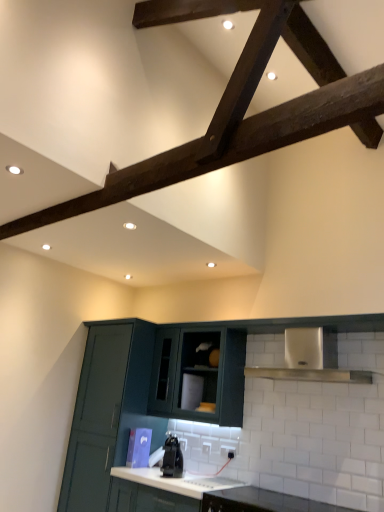
What do you see at coordinates (199, 375) in the screenshot?
I see `matte dark green cabinet at center, the 2th cabinetry viewed from the left` at bounding box center [199, 375].

Describe the element at coordinates (108, 410) in the screenshot. I see `matte dark green cabinet at lower left, which is the 3th cabinetry from right to left` at that location.

Identify the location of black glossy kettle at center. The height and width of the screenshot is (512, 384). (172, 458).

What do you see at coordinates (262, 502) in the screenshot? Image resolution: width=384 pixels, height=512 pixels. I see `white glossy countertop at lower center, the second countertop in the left-to-right sequence` at bounding box center [262, 502].

The height and width of the screenshot is (512, 384). I want to click on white glossy countertop at lower center, arranged as the 1th countertop when viewed from the right, so click(262, 502).

You are a GUI agent. You are given a task and a screenshot of the screen. Output one action in this format:
    pyautogui.click(x=<x>, y=<y>)
    Task: Click on the matte dark green cabinet at center, the 2th cabinetry viewed from the left
    Image resolution: width=384 pixels, height=512 pixels.
    Given the screenshot: What is the action you would take?
    pyautogui.click(x=199, y=375)

Can you confirm if matte dark green cabinet at lower left, which is the 3th cabinetry from right to left, is taller than matte dark green cabinet at center, the 2th cabinetry viewed from the left?

Yes, matte dark green cabinet at lower left, which is the 3th cabinetry from right to left, is taller than matte dark green cabinet at center, the 2th cabinetry viewed from the left.

Would you say matte dark green cabinet at lower left, which ranks as the first cabinetry in left-to-right order, contains matte dark green cabinet at center, the 2th cabinetry viewed from the left?

No, matte dark green cabinet at center, the 2th cabinetry viewed from the left, is not a part of matte dark green cabinet at lower left, which ranks as the first cabinetry in left-to-right order.

Is matte dark green cabinet at lower left, which ranks as the first cabinetry in left-to-right order, oriented towards matte dark green cabinet at center, the 2th cabinetry viewed from the left?

No.

Can you confirm if matte dark green cabinet at lower left, which ranks as the first cabinetry in left-to-right order, is thinner than matte dark green cabinet at center, the 2th cabinetry viewed from the left?

In fact, matte dark green cabinet at lower left, which ranks as the first cabinetry in left-to-right order, might be wider than matte dark green cabinet at center, the 2th cabinetry viewed from the left.

Is matte dark green cabinet at center, the 3th cabinetry from the left, smaller than matte dark green cabinet at lower left, which is the 3th cabinetry from right to left?

Correct, matte dark green cabinet at center, the 3th cabinetry from the left, occupies less space than matte dark green cabinet at lower left, which is the 3th cabinetry from right to left.

In the image, there is a matte dark green cabinet at center, the 1th cabinetry in the right-to-left sequence. At what (x,y) coordinates should I click in order to perform the action: click on cabinetry below it (from a real-world perspective). Please return your answer as a coordinate pair (x, y). Image resolution: width=384 pixels, height=512 pixels. Looking at the image, I should click on (108, 410).

Is matte dark green cabinet at center, the 1th cabinetry in the right-to-left sequence, situated inside matte dark green cabinet at lower left, which ranks as the first cabinetry in left-to-right order, or outside?

matte dark green cabinet at center, the 1th cabinetry in the right-to-left sequence, exists outside the volume of matte dark green cabinet at lower left, which ranks as the first cabinetry in left-to-right order.

Is matte dark green cabinet at center, the 2th cabinetry viewed from the left, situated inside matte dark green cabinet at lower left, which is the 3th cabinetry from right to left, or outside?

matte dark green cabinet at center, the 2th cabinetry viewed from the left, exists outside the volume of matte dark green cabinet at lower left, which is the 3th cabinetry from right to left.

Considering the sizes of matte dark green cabinet at center, the 2th cabinetry viewed from the left, and matte dark green cabinet at lower left, which ranks as the first cabinetry in left-to-right order, in the image, is matte dark green cabinet at center, the 2th cabinetry viewed from the left, taller or shorter than matte dark green cabinet at lower left, which ranks as the first cabinetry in left-to-right order,?

matte dark green cabinet at center, the 2th cabinetry viewed from the left, is shorter than matte dark green cabinet at lower left, which ranks as the first cabinetry in left-to-right order.

Is matte dark green cabinet at center, which is the second cabinetry in right-to-left order, bigger than matte dark green cabinet at lower left, which ranks as the first cabinetry in left-to-right order?

Incorrect, matte dark green cabinet at center, which is the second cabinetry in right-to-left order, is not larger than matte dark green cabinet at lower left, which ranks as the first cabinetry in left-to-right order.

Does matte dark green cabinet at center, which is the second cabinetry in right-to-left order, have a lesser width compared to matte dark green cabinet at lower left, which ranks as the first cabinetry in left-to-right order?

Yes.

From a real-world perspective, who is located higher, white glossy countertop at lower center, arranged as the 1th countertop when viewed from the right, or matte dark green cabinet at center, the 3th cabinetry from the left?

In real-world perspective, matte dark green cabinet at center, the 3th cabinetry from the left, is above.

Does white glossy countertop at lower center, arranged as the 1th countertop when viewed from the right, come behind matte dark green cabinet at center, the 1th cabinetry in the right-to-left sequence?

No, white glossy countertop at lower center, arranged as the 1th countertop when viewed from the right, is closer to the viewer.

Which is in front, point (211, 503) or point (356, 505)?

Positioned in front is point (356, 505).

Between white glossy countertop at lower center, the second countertop in the left-to-right sequence, and matte dark green cabinet at center, the 3th cabinetry from the left, which one has larger width?

Wider between the two is white glossy countertop at lower center, the second countertop in the left-to-right sequence.

Can you confirm if black glossy kettle at center is bigger than matte dark green cabinet at center, the 2th cabinetry viewed from the left?

No, black glossy kettle at center is not bigger than matte dark green cabinet at center, the 2th cabinetry viewed from the left.

Considering the positions of objects black glossy kettle at center and matte dark green cabinet at center, the 2th cabinetry viewed from the left, in the image provided, who is more to the right, black glossy kettle at center or matte dark green cabinet at center, the 2th cabinetry viewed from the left,?

matte dark green cabinet at center, the 2th cabinetry viewed from the left.

Is black glossy kettle at center beside matte dark green cabinet at center, which is the second cabinetry in right-to-left order?

There is a gap between black glossy kettle at center and matte dark green cabinet at center, which is the second cabinetry in right-to-left order.

Does matte dark green cabinet at center, the 2th cabinetry viewed from the left, touch black glossy kettle at center?

They are not placed beside each other.

What's the angular difference between matte dark green cabinet at center, the 2th cabinetry viewed from the left, and black glossy kettle at center's facing directions?

The angle between the facing direction of matte dark green cabinet at center, the 2th cabinetry viewed from the left, and the facing direction of black glossy kettle at center is 4.86 degrees.

From the picture: Considering the sizes of objects matte dark green cabinet at center, the 2th cabinetry viewed from the left, and black glossy kettle at center in the image provided, who is thinner, matte dark green cabinet at center, the 2th cabinetry viewed from the left, or black glossy kettle at center?

black glossy kettle at center.

Which object is closer to the camera taking this photo, white glossy countertop at center, the first countertop in the left-to-right sequence, or matte dark green cabinet at lower left, which ranks as the first cabinetry in left-to-right order?

white glossy countertop at center, the first countertop in the left-to-right sequence.

From the image's perspective, which object appears higher, white glossy countertop at center, arranged as the second countertop when viewed from the right, or matte dark green cabinet at lower left, which is the 3th cabinetry from right to left?

matte dark green cabinet at lower left, which is the 3th cabinetry from right to left, from the image's perspective.

In the scene shown: How far apart are white glossy countertop at center, arranged as the second countertop when viewed from the right, and matte dark green cabinet at lower left, which ranks as the first cabinetry in left-to-right order?

They are 25.86 inches apart.

From a real-world perspective, is white glossy countertop at center, arranged as the second countertop when viewed from the right, over matte dark green cabinet at lower left, which is the 3th cabinetry from right to left?

Actually, white glossy countertop at center, arranged as the second countertop when viewed from the right, is physically below matte dark green cabinet at lower left, which is the 3th cabinetry from right to left, in the real world.

From the image's perspective, which cabinetry is the 2nd one below the matte dark green cabinet at center, the 2th cabinetry viewed from the left? Please provide its 2D coordinates.

[(108, 410)]

From the image's perspective, starting from the matte dark green cabinet at lower left, which is the 3th cabinetry from right to left, which cabinetry is the 1st one above? Please provide its 2D coordinates.

[(154, 394)]

From the image, which object appears to be farther from matte dark green cabinet at center, the 3th cabinetry from the left, black glossy kettle at center or matte dark green cabinet at center, the 2th cabinetry viewed from the left?

The object further to matte dark green cabinet at center, the 3th cabinetry from the left, is black glossy kettle at center.

From the image, which object appears to be nearer to white glossy countertop at center, the first countertop in the left-to-right sequence, black glossy kettle at center or matte dark green cabinet at center, the 3th cabinetry from the left?

black glossy kettle at center.

Estimate the real-world distances between objects in this image. Which object is further from black glossy kettle at center, matte dark green cabinet at center, the 1th cabinetry in the right-to-left sequence, or matte dark green cabinet at lower left, which ranks as the first cabinetry in left-to-right order?

Based on the image, matte dark green cabinet at center, the 1th cabinetry in the right-to-left sequence, appears to be further to black glossy kettle at center.

Based on their spatial positions, is matte dark green cabinet at center, the 3th cabinetry from the left, or matte dark green cabinet at lower left, which is the 3th cabinetry from right to left, closer to white glossy countertop at lower center, arranged as the 1th countertop when viewed from the right?

matte dark green cabinet at center, the 3th cabinetry from the left, is positioned closer to the anchor white glossy countertop at lower center, arranged as the 1th countertop when viewed from the right.

Based on their spatial positions, is white glossy countertop at lower center, arranged as the 1th countertop when viewed from the right, or black glossy kettle at center closer to white glossy countertop at center, the first countertop in the left-to-right sequence?

Based on the image, black glossy kettle at center appears to be nearer to white glossy countertop at center, the first countertop in the left-to-right sequence.

Considering their positions, is matte dark green cabinet at center, which is the second cabinetry in right-to-left order, positioned closer to black glossy kettle at center than white glossy countertop at lower center, the second countertop in the left-to-right sequence?

Based on the image, matte dark green cabinet at center, which is the second cabinetry in right-to-left order, appears to be nearer to black glossy kettle at center.

Considering their positions, is matte dark green cabinet at center, which is the second cabinetry in right-to-left order, positioned closer to white glossy countertop at lower center, arranged as the 1th countertop when viewed from the right, than black glossy kettle at center?

black glossy kettle at center is positioned closer to the anchor white glossy countertop at lower center, arranged as the 1th countertop when viewed from the right.

Looking at the image, which one is located further to black glossy kettle at center, matte dark green cabinet at center, the 3th cabinetry from the left, or white glossy countertop at lower center, the second countertop in the left-to-right sequence?

The object further to black glossy kettle at center is matte dark green cabinet at center, the 3th cabinetry from the left.

The image size is (384, 512). Identify the location of countertop located between white glossy countertop at lower center, arranged as the 1th countertop when viewed from the right, and matte dark green cabinet at center, which is the second cabinetry in right-to-left order, in the depth direction. (175, 481).

In order to click on appliance located between matte dark green cabinet at lower left, which is the 3th cabinetry from right to left, and matte dark green cabinet at center, the 2th cabinetry viewed from the left, in the left-right direction in this screenshot , I will do `click(172, 458)`.

The width and height of the screenshot is (384, 512). I want to click on countertop between matte dark green cabinet at lower left, which is the 3th cabinetry from right to left, and matte dark green cabinet at center, the 1th cabinetry in the right-to-left sequence, from left to right, so click(x=175, y=481).

I want to click on appliance that lies between matte dark green cabinet at center, the 2th cabinetry viewed from the left, and white glossy countertop at center, arranged as the second countertop when viewed from the right, from top to bottom, so 172,458.